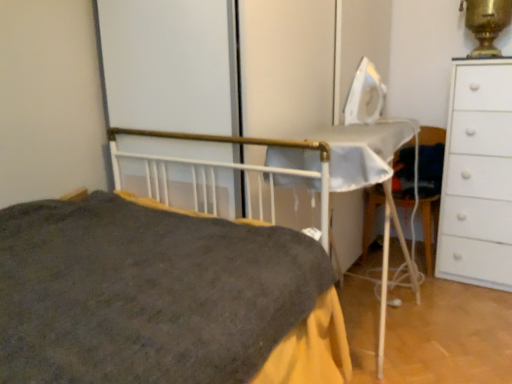
Question: Does dark gray fabric bed at center contain gold metallic samovar at upper right?

Choices:
 (A) no
 (B) yes

Answer: (A)

Question: Is dark gray fabric bed at center bigger than gold metallic samovar at upper right?

Choices:
 (A) no
 (B) yes

Answer: (B)

Question: Does dark gray fabric bed at center have a smaller size compared to gold metallic samovar at upper right?

Choices:
 (A) yes
 (B) no

Answer: (B)

Question: Does dark gray fabric bed at center have a lesser height compared to gold metallic samovar at upper right?

Choices:
 (A) no
 (B) yes

Answer: (A)

Question: From the image's perspective, is dark gray fabric bed at center above gold metallic samovar at upper right?

Choices:
 (A) yes
 (B) no

Answer: (B)

Question: From the image's perspective, is dark gray fabric bed at center under gold metallic samovar at upper right?

Choices:
 (A) no
 (B) yes

Answer: (B)

Question: Is white fabric chair at right facing away from dark gray fabric bed at center?

Choices:
 (A) yes
 (B) no

Answer: (B)

Question: Considering the relative sizes of white fabric chair at right and dark gray fabric bed at center in the image provided, is white fabric chair at right taller than dark gray fabric bed at center?

Choices:
 (A) no
 (B) yes

Answer: (A)

Question: Is white fabric chair at right smaller than dark gray fabric bed at center?

Choices:
 (A) no
 (B) yes

Answer: (B)

Question: Is white fabric chair at right further to the viewer compared to dark gray fabric bed at center?

Choices:
 (A) no
 (B) yes

Answer: (B)

Question: Is white fabric chair at right wider than dark gray fabric bed at center?

Choices:
 (A) no
 (B) yes

Answer: (A)

Question: Can you confirm if white fabric chair at right is positioned to the left of dark gray fabric bed at center?

Choices:
 (A) no
 (B) yes

Answer: (A)

Question: From a real-world perspective, is white matte chest of drawers at right physically below gold metallic samovar at upper right?

Choices:
 (A) yes
 (B) no

Answer: (A)